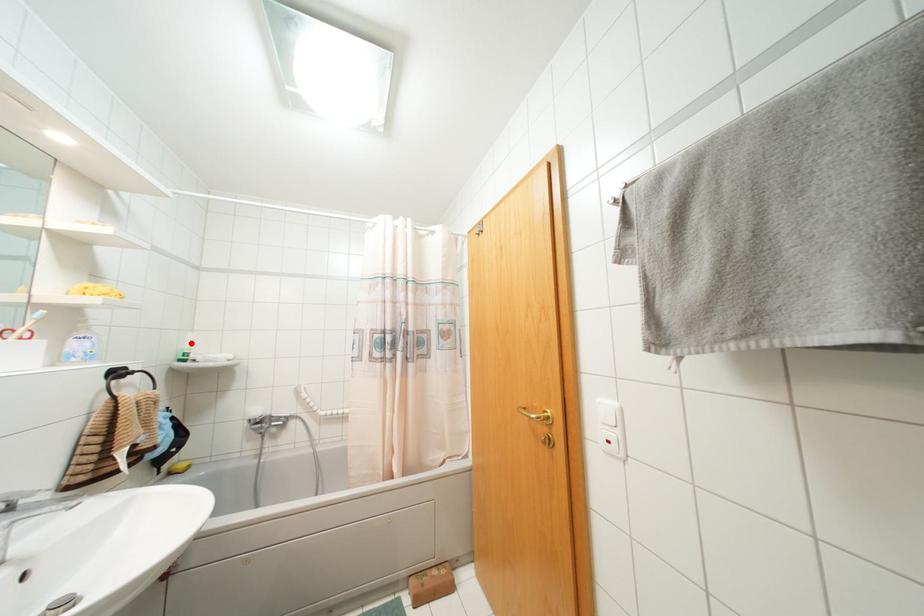
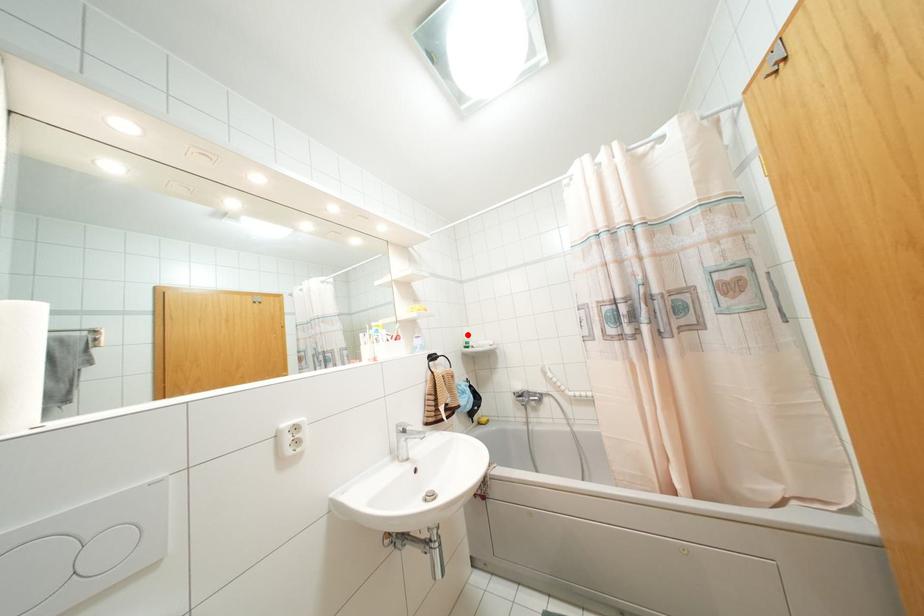
I am providing you with two images of the same scene from different viewpoints. A red point is marked on the first image and another point is marked on the second image. Is the red point in image1 aligned with the point shown in image2?

Yes